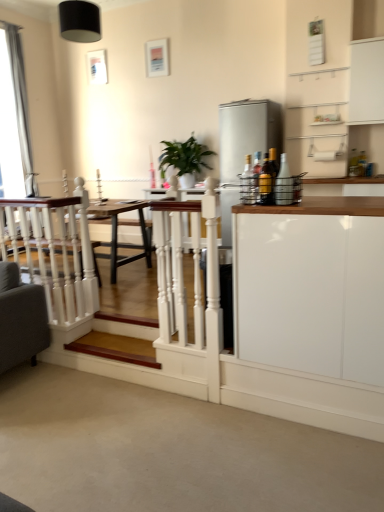
Find the location of a particular element. The image size is (384, 512). free location to the right of translucent glass bottle at right, the first bottle when ordered from right to left is located at coordinates (310, 204).